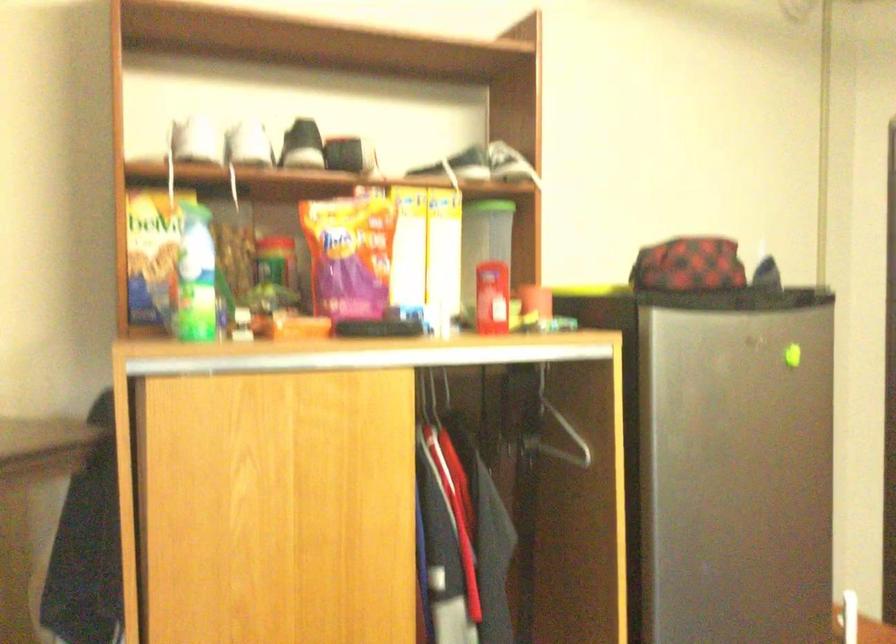
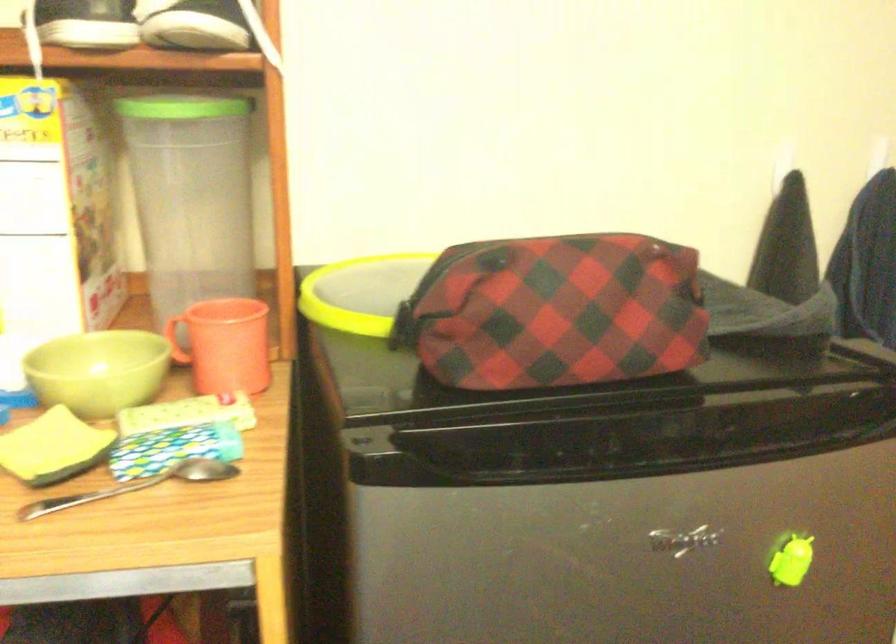
Locate, in the second image, the point that corresponds to point (794, 355) in the first image.

(791, 560)